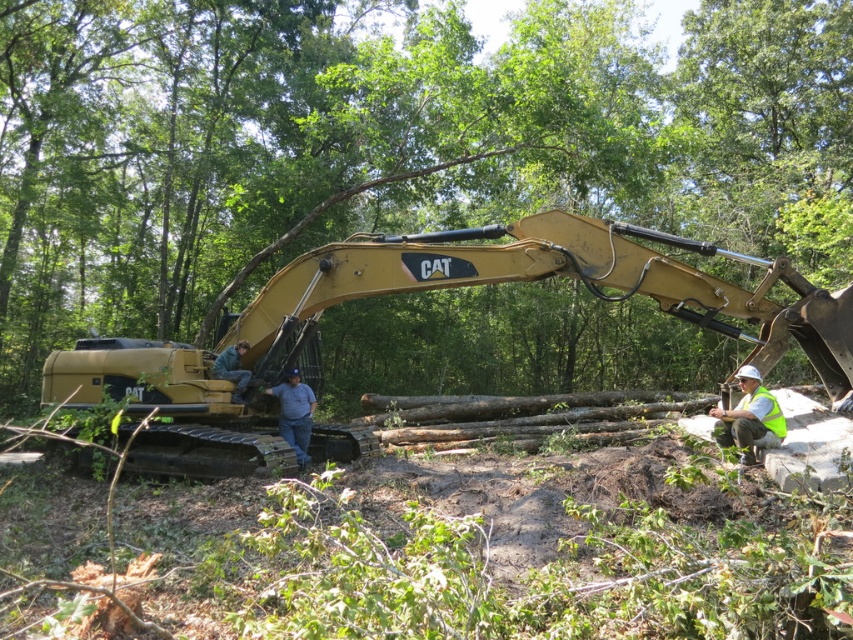
Question: Which object is positioned farthest from the blue jeans at center?

Choices:
 (A) blue denim jeans at center
 (B) yellow reflective vest at lower right
 (C) matte yellow excavator at center
 (D) smooth brown log at center

Answer: (D)

Question: Can you confirm if smooth brown log at center is positioned to the left of yellow reflective vest at lower right?

Choices:
 (A) no
 (B) yes

Answer: (B)

Question: Estimate the real-world distances between objects in this image. Which object is farther from the smooth brown log at center?

Choices:
 (A) matte yellow excavator at center
 (B) yellow reflective vest at lower right
 (C) blue jeans at center
 (D) blue denim jeans at center

Answer: (A)

Question: Is smooth brown log at center smaller than blue jeans at center?

Choices:
 (A) yes
 (B) no

Answer: (B)

Question: Can you confirm if matte yellow excavator at center is bigger than blue jeans at center?

Choices:
 (A) yes
 (B) no

Answer: (B)

Question: Which point is farther from the camera taking this photo?

Choices:
 (A) (563, 211)
 (B) (234, 355)
 (C) (294, 435)

Answer: (C)